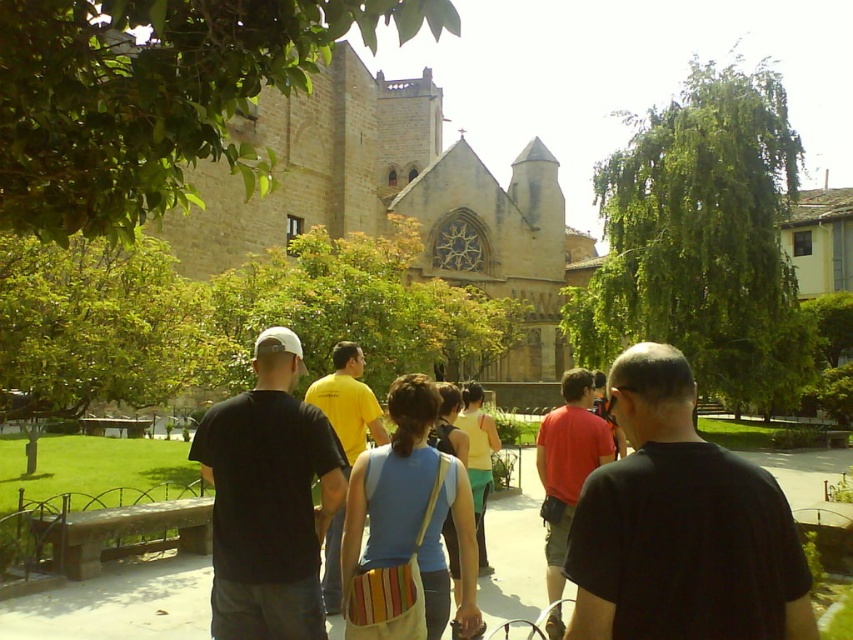
You are a photographer standing in the courtyard with two subjects wearing a red cotton shirt at center and a yellow cotton tank top at center. You need to take a photo that includes both subjects in the frame. Given that your camera has a minimum focus distance of 3 meters, will you be able to capture both subjects clearly without moving either of them?

The distance between the red cotton shirt at center and the yellow cotton tank top at center is 4.71 meters. Since the minimum focus distance required is 3 meters, the subjects are within the required distance, so the photographer can capture both clearly without moving them.

You are standing at a point in the courtyard and want to know how far you are from the camera. The coordinates of your current position are point [440,621]. Can you determine the distance?

The distance between point [440,621] and the camera is 39.37 meters.